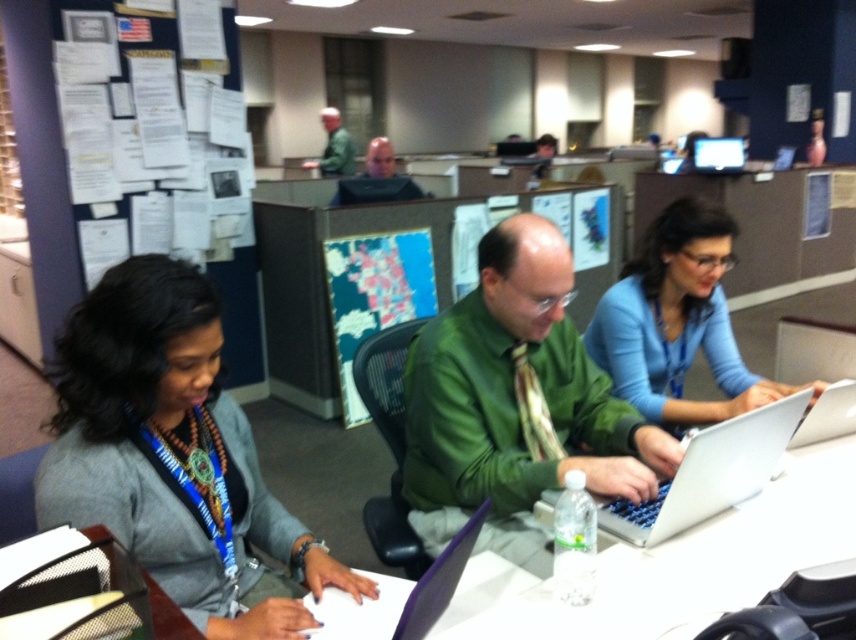
Question: Among these objects, which one is farthest from the camera?

Choices:
 (A) green matte shirt at center
 (B) green textured tie at center

Answer: (B)

Question: From the image, what is the correct spatial relationship of green matte shirt at center in relation to purple matte laptop at center?

Choices:
 (A) above
 (B) below

Answer: (A)

Question: Among these objects, which one is farthest from the camera?

Choices:
 (A) green textured tie at center
 (B) gray fabric jacket at lower left
 (C) silver metallic monitor at upper center

Answer: (C)

Question: In this image, where is gray fabric jacket at lower left located relative to purple matte laptop at center?

Choices:
 (A) above
 (B) below

Answer: (A)

Question: Which object is closer to the camera taking this photo?

Choices:
 (A) silver metallic laptop at center
 (B) green textured tie at center
 (C) blue fabric shirt at center

Answer: (A)

Question: Can you confirm if green matte shirt at center is smaller than purple matte laptop at center?

Choices:
 (A) yes
 (B) no

Answer: (B)